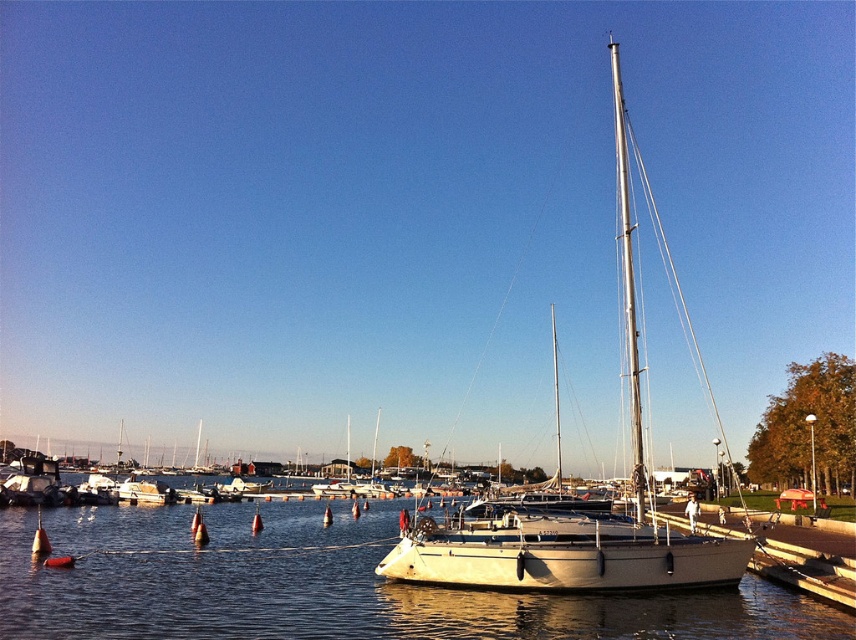
Between white matte water at center and white matte sailboat at center, which one has less height?

white matte water at center is shorter.

Is white matte water at center above white matte sailboat at center?

No.

Which is behind, point (27, 582) or point (580, 529)?

The point (580, 529) is more distant.

You are a GUI agent. You are given a task and a screenshot of the screen. Output one action in this format:
    pyautogui.click(x=<x>, y=<y>)
    Task: Click on the white matte water at center
    This screenshot has height=640, width=856.
    Given the screenshot: What is the action you would take?
    pyautogui.click(x=325, y=584)